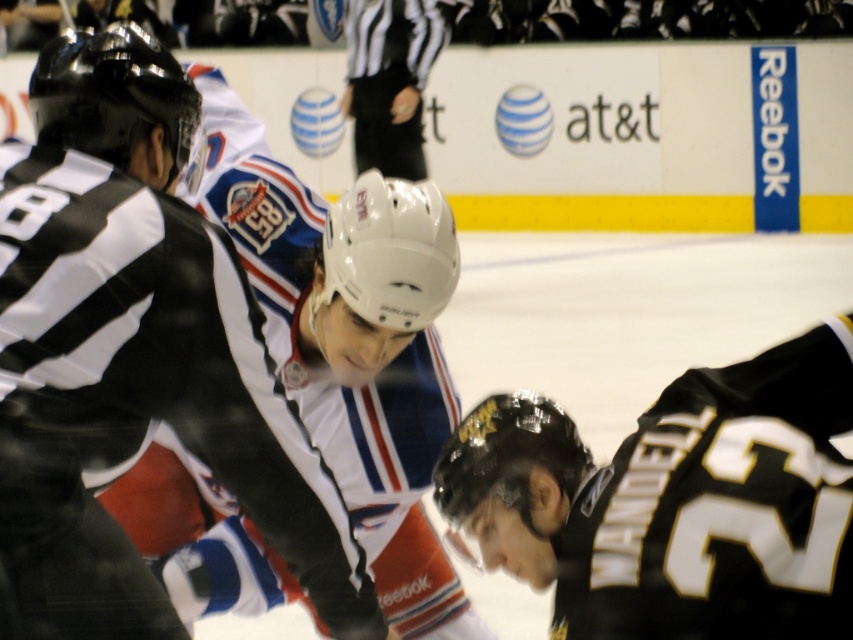
Based on the scene described, which of the two players, the white matte jersey at center or the black matte jersey at lower right, is positioned higher in the image?

The white matte jersey at center is positioned higher in the image as it is above the black matte jersey at lower right.